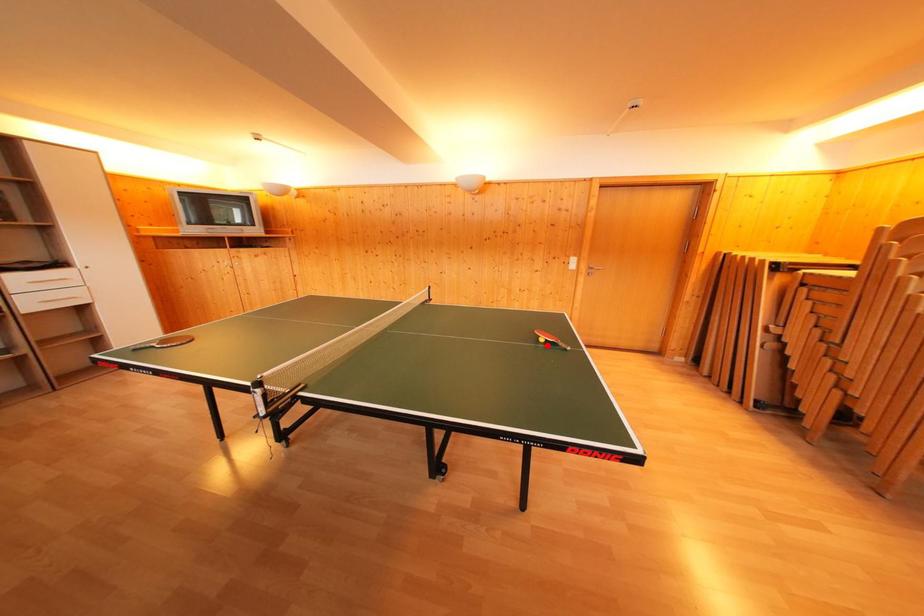
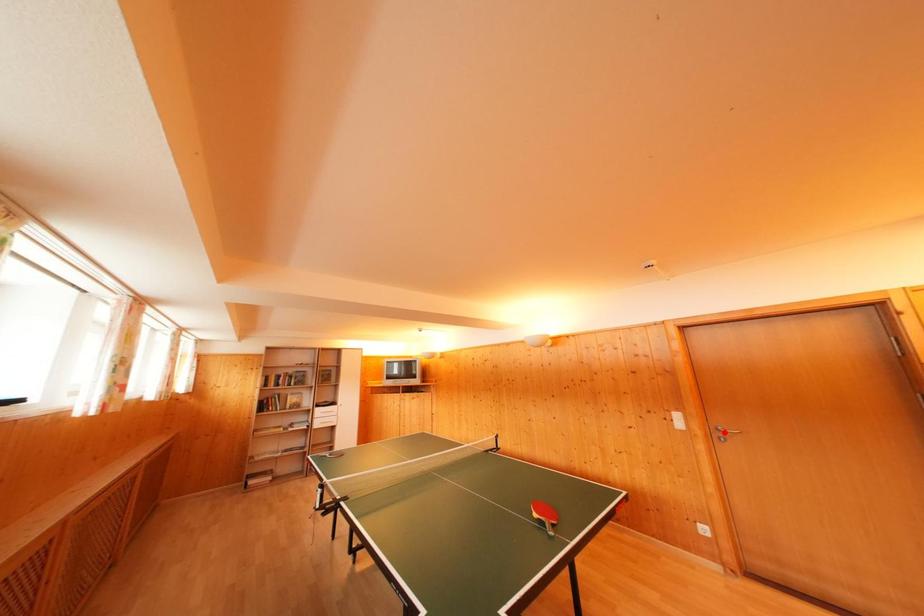
I am providing you with two images of the same scene from different viewpoints. A red point is marked on the first image and another point is marked on the second image. Is the marked point in image1 the same physical position as the marked point in image2?

No